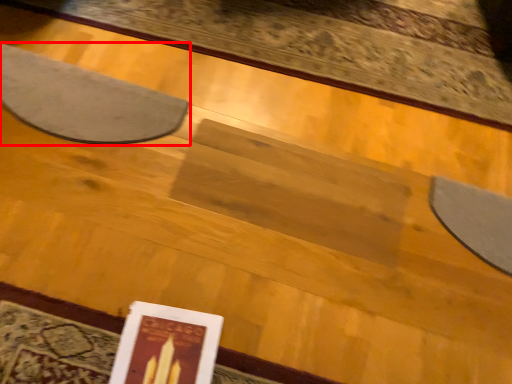
Question: From the image's perspective, what is the correct spatial relationship of mat (annotated by the red box) in relation to paperback book?

Choices:
 (A) below
 (B) above

Answer: (B)